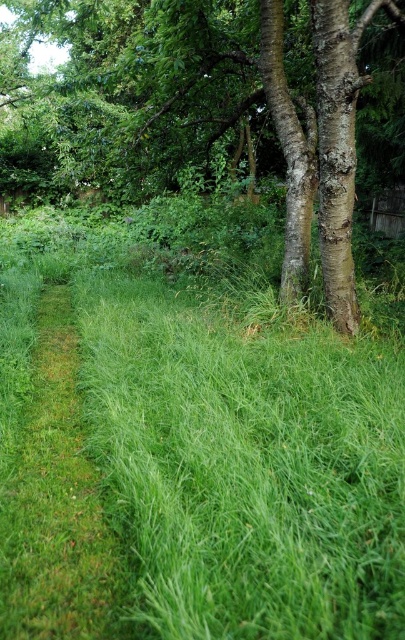
You are standing in the garden and want to walk from the green grassy at center to the smooth bark tree at center. Which direction should you move to reach the wider object?

The smooth bark tree at center has a greater width than the green grassy at center, so you should move towards the smooth bark tree at center to reach the wider object.

You are a gardener who wants to mow the green grassy at center. You notice the smooth bark tree at center is in the way. Based on their positions, can you mow the grass without moving the tree?

The green grassy at center is to the left of the smooth bark tree at center, so you can mow the grass without moving the tree because they are positioned side by side.

You are standing in the garden scene described. You need to place a small decorative statue exactly at the center of the image. However, there is already a green grassy area at center. Can you confirm if the statue will be placed on top of the green grassy at center?

The green grassy at center is located at point coordinates that are very close to the center of the image, so placing the statue there would indeed place it on top of the green grassy at center.